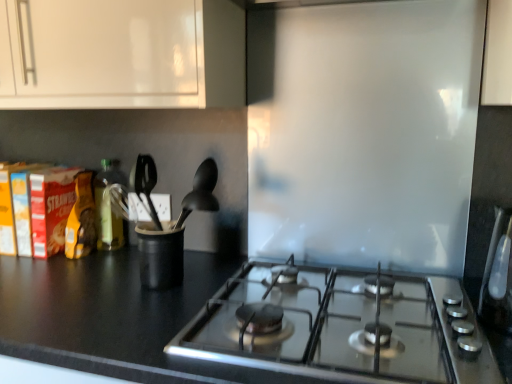
You are a GUI agent. You are given a task and a screenshot of the screen. Output one action in this format:
    pyautogui.click(x=<x>, y=<y>)
    Task: Click on the vacant space to the right of black plastic utensil holder at center
    The width and height of the screenshot is (512, 384).
    Given the screenshot: What is the action you would take?
    pyautogui.click(x=223, y=275)